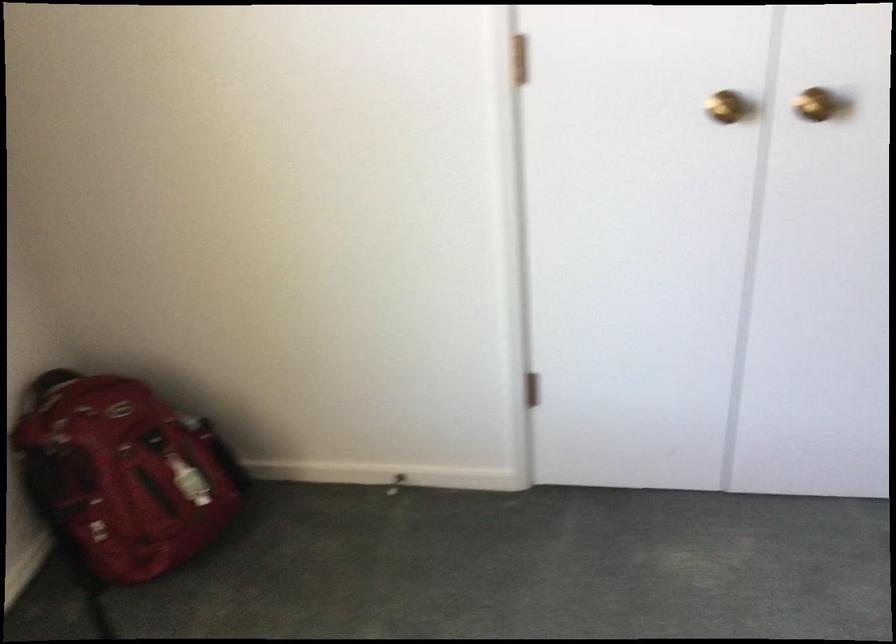
Find the location of `red backpack`. red backpack is located at coordinates (123, 474).